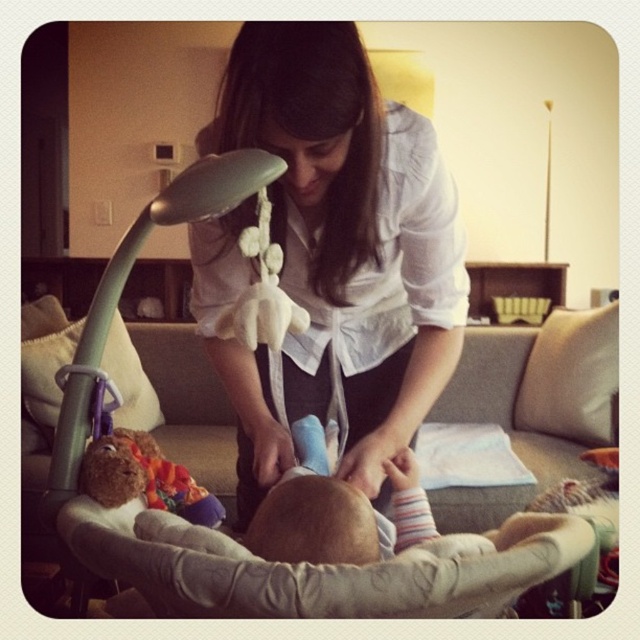
Looking at this image, you are a parent trying to choose between placing a new toy either in the gray fabric baby carriage at center or the brown plush bear at lower left. Based on their sizes, which object can accommodate a larger toy?

The gray fabric baby carriage at center is larger in size than the brown plush bear at lower left, so it can accommodate a larger toy.

You are a photographer setting up a photo shoot in this scene. You need to ensure that the white satin blouse at center does not block the view of the gray fabric baby carriage at center in your shot. What adjustment should you make to your camera angle?

To ensure the white satin blouse at center does not block the view of the gray fabric baby carriage at center, you should adjust your camera angle to position it behind the white satin blouse at center so that the baby carriage becomes visible behind it.

Looking at this image, you are a parent trying to place a new toy between the gray fabric baby carriage at center and the brown plush bear at lower left. What is the minimum distance you need to maintain between these two objects to ensure the toy fits?

The minimum distance you need to maintain between the gray fabric baby carriage at center and the brown plush bear at lower left is 4.23 feet to ensure the toy fits.